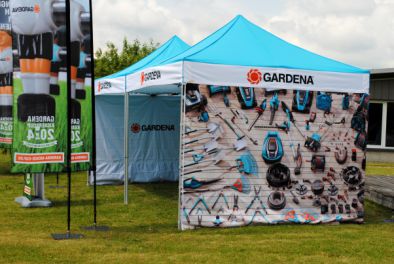
The width and height of the screenshot is (394, 264). Find the location of `window`. window is located at coordinates (369, 124), (386, 125).